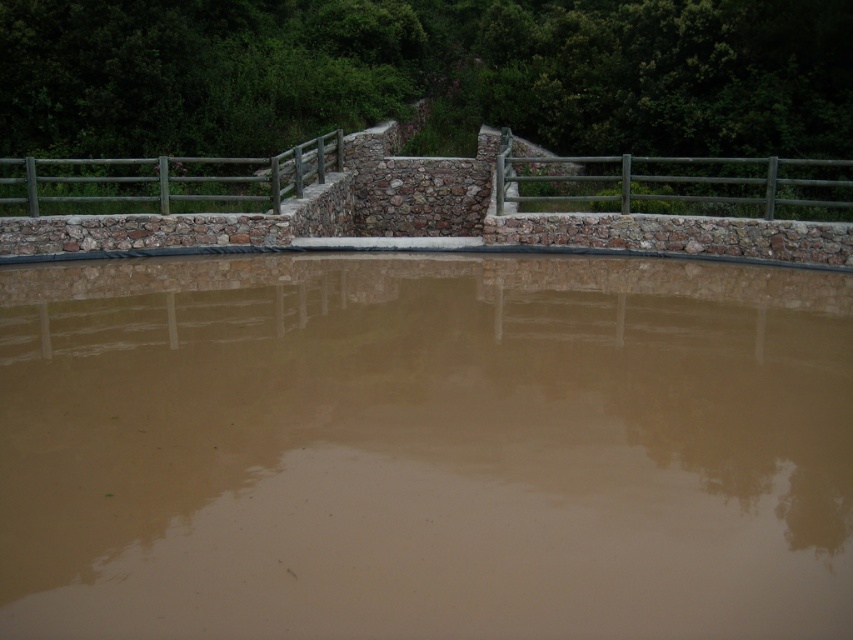
Question: Among these points, which one is nearest to the camera?

Choices:
 (A) (497, 260)
 (B) (18, 172)

Answer: (A)

Question: Does brown matte water at center have a larger size compared to green wooden rail at upper center?

Choices:
 (A) no
 (B) yes

Answer: (B)

Question: Is brown matte water at center positioned before green metallic rail at upper right?

Choices:
 (A) no
 (B) yes

Answer: (B)

Question: Which point is closer to the camera taking this photo?

Choices:
 (A) (693, 211)
 (B) (74, 196)
 (C) (428, 429)

Answer: (C)

Question: Can you confirm if brown matte water at center is positioned above green metallic rail at upper right?

Choices:
 (A) no
 (B) yes

Answer: (A)

Question: Which point is farther to the camera?

Choices:
 (A) (770, 184)
 (B) (693, 332)

Answer: (A)